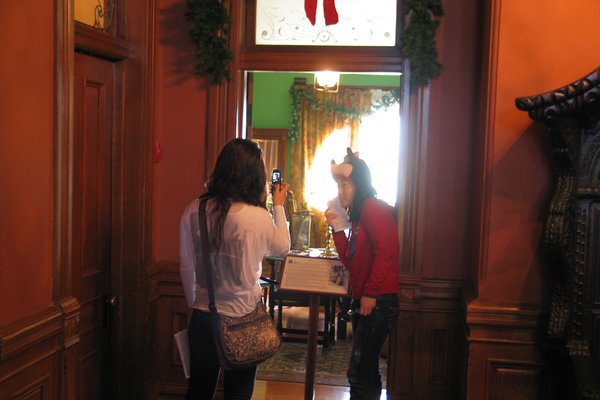
Find the location of a particular element. Image resolution: width=600 pixels, height=400 pixels. internal window above doors is located at coordinates (87, 5), (348, 15).